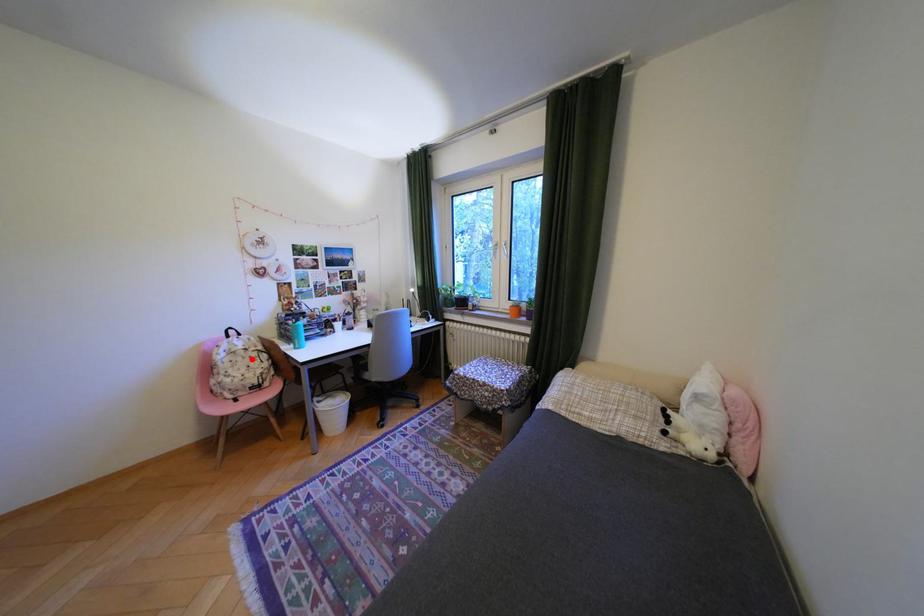
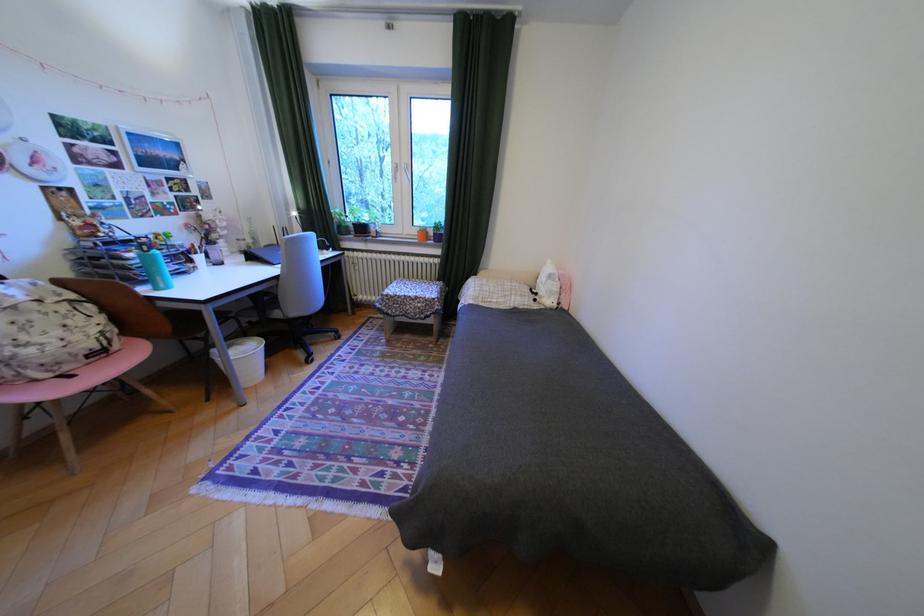
Find the pixel in the second image that matches the highlighted location in the first image.

(49, 317)